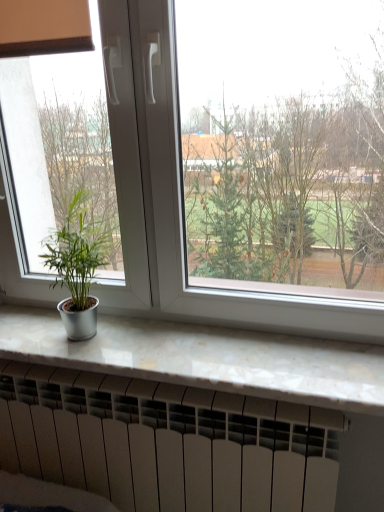
Identify the location of free space between white plastic window at center and green matte plant at left. This screenshot has width=384, height=512. (158, 352).